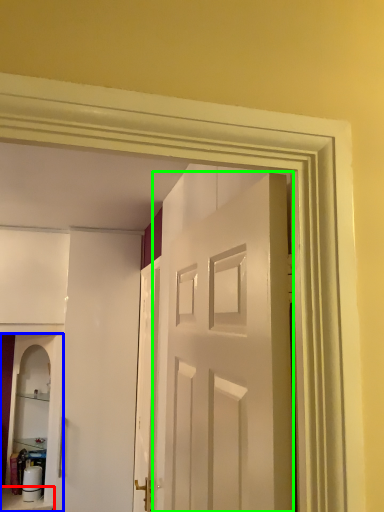
Question: Which is nearer to the furniture (highlighted by a red box)? cabinetry (highlighted by a blue box) or door (highlighted by a green box).

Choices:
 (A) cabinetry
 (B) door

Answer: (A)